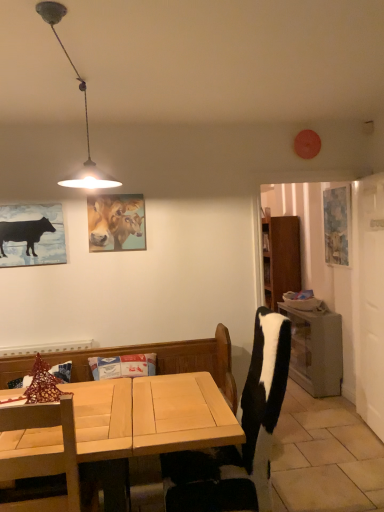
Question: Choose the correct answer: Is blue textured painting at right, the 2th picture frame viewed from the left, inside metallic pendant light at upper left or outside it?

Choices:
 (A) inside
 (B) outside

Answer: (B)

Question: From a real-world perspective, is blue textured painting at right, which is counted as the 2th picture frame, starting from the front, physically located above or below metallic pendant light at upper left?

Choices:
 (A) above
 (B) below

Answer: (B)

Question: Estimate the real-world distances between objects in this image. Which object is farther from the wooden table at right?

Choices:
 (A) wooden chair at lower left, which is the 2th chair in right-to-left order
 (B) light wood desk at lower left
 (C) metallic pendant light at upper left
 (D) black matte cow at left
 (E) black and white fabric chair at center, which is counted as the second chair, starting from the left

Answer: (C)

Question: Which object is positioned closest to the matte wooden picture frame at upper center, the 1th picture frame in the left-to-right sequence?

Choices:
 (A) black and white fabric chair at center, which is the 1th chair from right to left
 (B) light wood desk at lower left
 (C) wooden chair at lower left, which is the 2th chair in right-to-left order
 (D) metallic pendant light at upper left
 (E) blue textured painting at right, acting as the first picture frame starting from the back

Answer: (D)